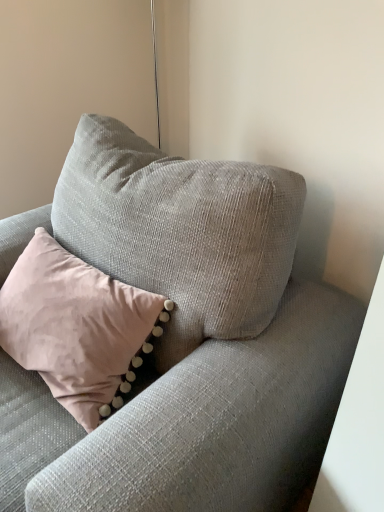
Question: From a real-world perspective, is textured gray couch at center physically located above or below pink velvet pillow at upper left?

Choices:
 (A) above
 (B) below

Answer: (B)

Question: Considering their positions, is textured gray couch at center located in front of or behind pink velvet pillow at upper left?

Choices:
 (A) behind
 (B) front

Answer: (B)

Question: From the image's perspective, is textured gray couch at center above or below pink velvet pillow at upper left?

Choices:
 (A) above
 (B) below

Answer: (B)

Question: In terms of width, does pink velvet pillow at upper left look wider or thinner when compared to textured gray couch at center?

Choices:
 (A) wide
 (B) thin

Answer: (B)

Question: Choose the correct answer: Is pink velvet pillow at upper left inside textured gray couch at center or outside it?

Choices:
 (A) outside
 (B) inside

Answer: (B)

Question: In the image, is pink velvet pillow at upper left positioned in front of or behind textured gray couch at center?

Choices:
 (A) front
 (B) behind

Answer: (B)

Question: Visually, is pink velvet pillow at upper left positioned to the left or to the right of textured gray couch at center?

Choices:
 (A) left
 (B) right

Answer: (A)